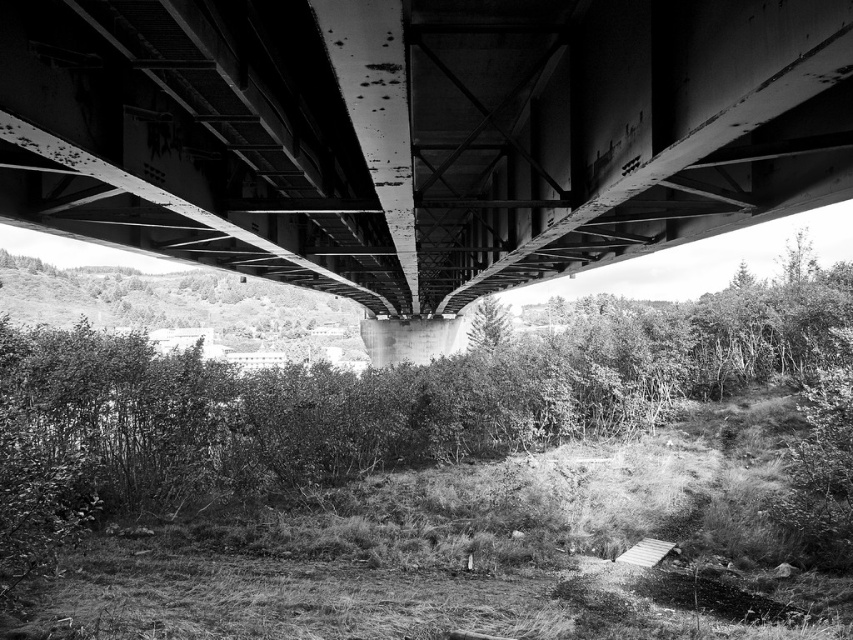
You are a photographer standing under the bridge. You want to capture a photo where both the rusty metal bridge at center and the green leafy shrubs at center are visible. Based on their widths, which object will occupy more space in the photo?

The green leafy shrubs at center will occupy more space in the photo because the rusty metal bridge at center is narrower than the green leafy shrubs at center.

You are standing directly under the rusty metal bridge at center. Based on the coordinates provided, what is the exact 2D position of the bridge in the image?

The rusty metal bridge at center is located at the 2D coordinates of point (418,134).

Based on the scene described, which object is positioned to the right when observing the rusty metal bridge at center and green leafy shrubs at center?

The rusty metal bridge at center is positioned to the right of the green leafy shrubs at center.